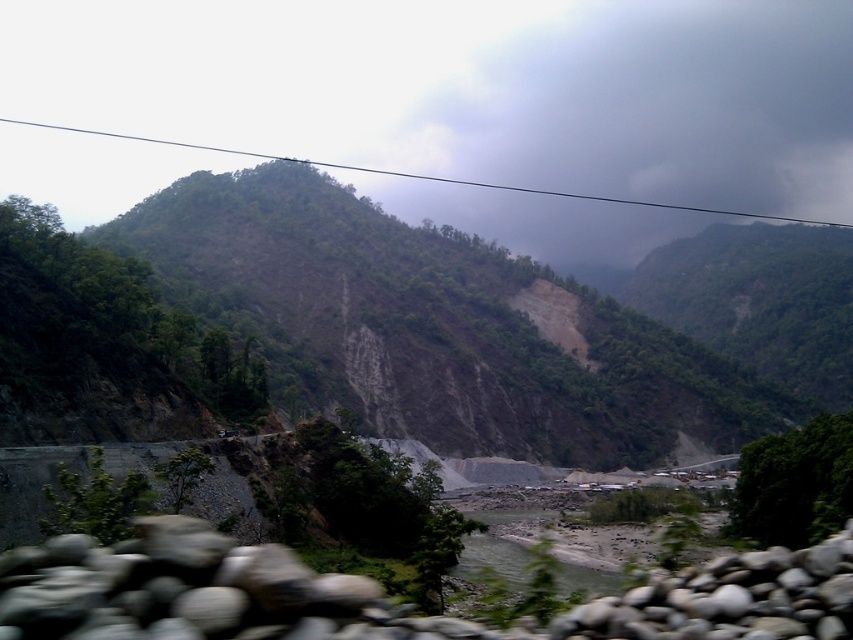
You are a hiker planning to cross the river using the gray smooth stones at lower right. Before you start, you look up and notice the dark gray cloud at upper center. Based on their sizes, which one is more likely to cause immediate danger to your crossing?

The dark gray cloud at upper center is larger than the gray smooth stones at lower right, so it is more likely to cause immediate danger because larger clouds can produce heavy rain or storms that might increase the river flow, making the crossing risky.

You are a hiker trying to determine the direction of the river flow based on the scene. Since the brown sandy river at center is behind dark gray cloud at upper center, can you infer which direction the river flows relative to the clouds?

The brown sandy river at center is behind dark gray cloud at upper center, so the river flows away from the clouds.